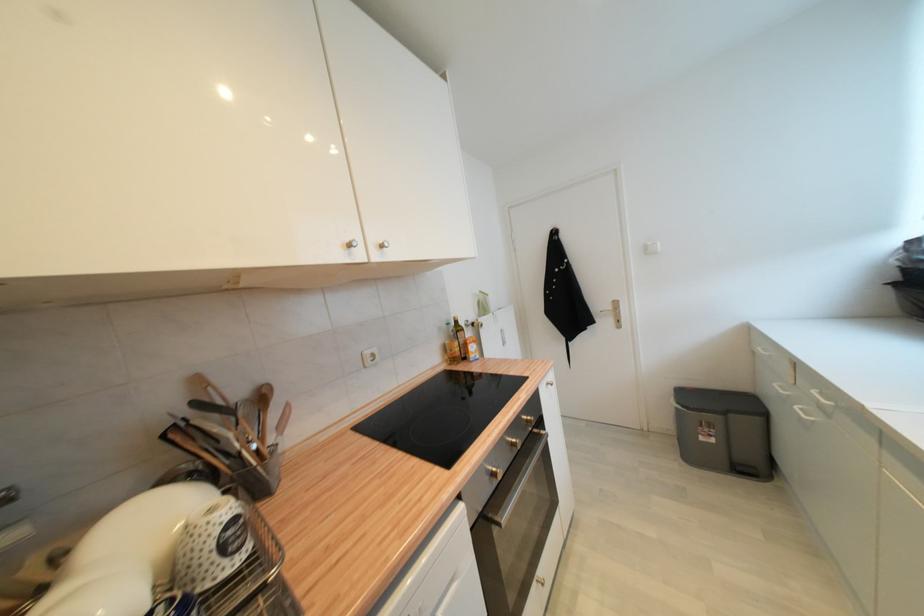
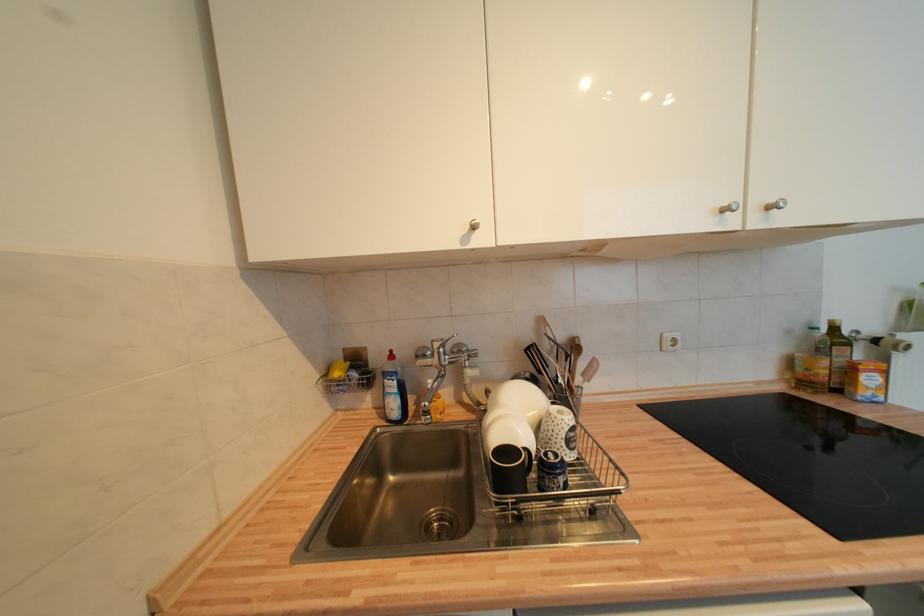
Question: The first image is from the beginning of the video and the second image is from the end. How did the camera likely rotate when shooting the video?

Choices:
 (A) Left
 (B) Right
 (C) Up
 (D) Down

Answer: (A)